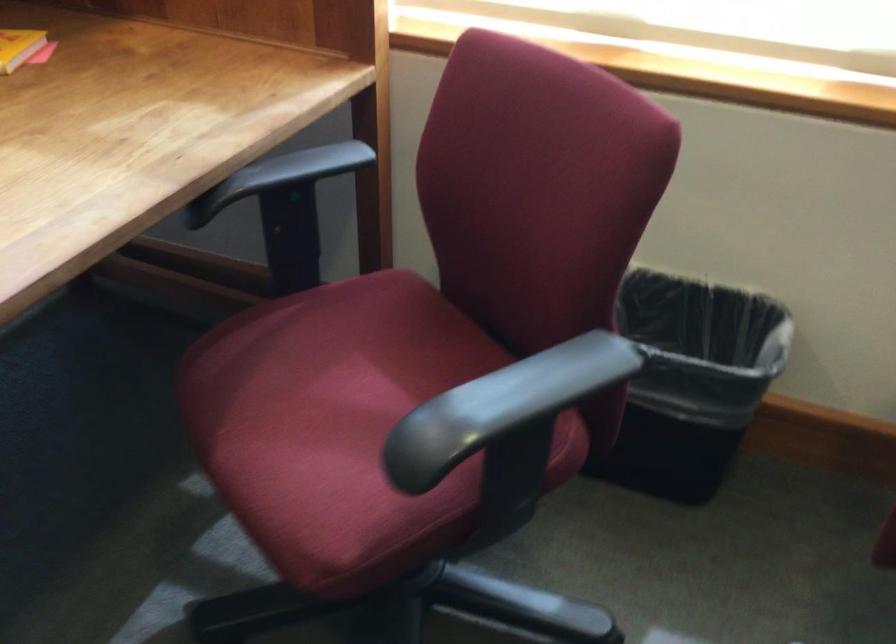
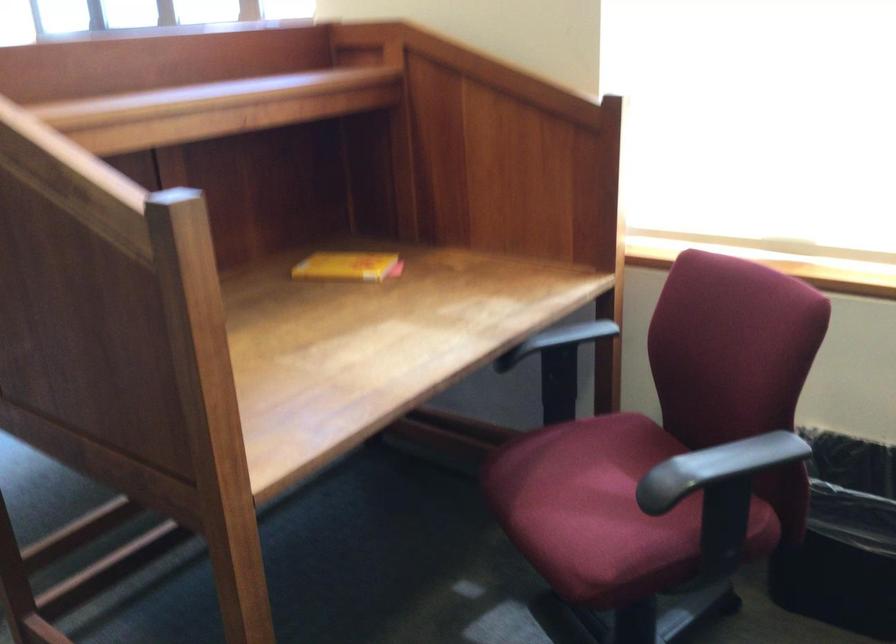
Locate, in the second image, the point that corresponds to pixel 328 440 in the first image.

(592, 509)